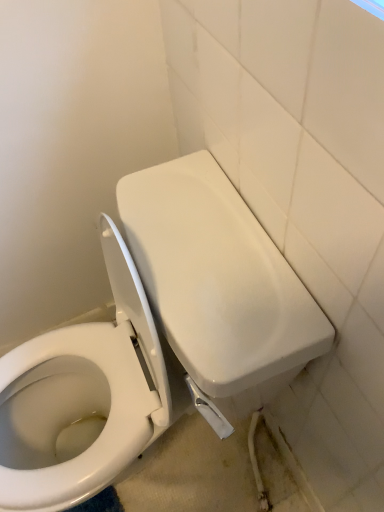
Question: Should I look upward or downward to see white glossy toilet at center?

Choices:
 (A) up
 (B) down

Answer: (B)